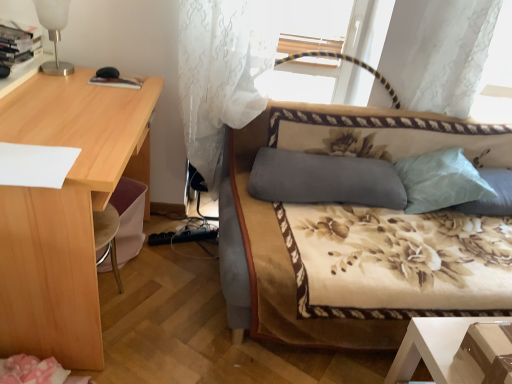
From the picture: In order to face light blue fabric pillow at right, which ranks as the first pillow in right-to-left order, should I rotate leftwards or rightwards?

Rotate right and turn 30.320 degrees.

The image size is (512, 384). Describe the element at coordinates (496, 192) in the screenshot. I see `light blue fabric pillow at right, which ranks as the first pillow in right-to-left order` at that location.

Describe the element at coordinates (65, 210) in the screenshot. I see `light wood desk at left` at that location.

Measure the distance between point (420,167) and camera.

Point (420,167) is 2.02 meters from camera.

Where is `white sheer curtain at center`? This screenshot has width=512, height=384. white sheer curtain at center is located at coordinates (222, 73).

Measure the distance between gray fabric pillow at center, which is the 1th pillow in left-to-right order, and camera.

gray fabric pillow at center, which is the 1th pillow in left-to-right order, is 1.82 meters from camera.

At what (x,y) coordinates should I click in order to perform the action: click on gray fabric pillow at center, which is the 1th pillow in left-to-right order. Please return your answer as a coordinate pair (x, y). The image size is (512, 384). Looking at the image, I should click on (324, 179).

The width and height of the screenshot is (512, 384). In order to click on white frosted glass table lamp at upper left in this screenshot , I will do `click(54, 32)`.

Is floral-patterned fabric couch at center located outside gray fabric pillow at center, which is the 1th pillow in left-to-right order?

That's correct, floral-patterned fabric couch at center is outside of gray fabric pillow at center, which is the 1th pillow in left-to-right order.

Are floral-patterned fabric couch at center and gray fabric pillow at center, which is the 1th pillow in left-to-right order, far apart?

floral-patterned fabric couch at center is actually quite close to gray fabric pillow at center, which is the 1th pillow in left-to-right order.

Is floral-patterned fabric couch at center looking in the opposite direction of gray fabric pillow at center, which is the 1th pillow in left-to-right order?

Correct, floral-patterned fabric couch at center is looking away from gray fabric pillow at center, which is the 1th pillow in left-to-right order.

Between floral-patterned fabric couch at center and gray fabric pillow at center, which is the 1th pillow in left-to-right order, which one has less height?

gray fabric pillow at center, which is the 1th pillow in left-to-right order, is shorter.

Which is closer, (61, 21) or (294, 305)?

Point (61, 21) is farther from the camera than point (294, 305).

Can you confirm if white frosted glass table lamp at upper left is smaller than floral-patterned fabric couch at center?

Yes.

How many degrees apart are the facing directions of white frosted glass table lamp at upper left and floral-patterned fabric couch at center?

91.2 degrees separate the facing orientations of white frosted glass table lamp at upper left and floral-patterned fabric couch at center.

From a real-world perspective, is gray fabric pillow at center, which is counted as the 3th pillow, starting from the right, located beneath white sheer curtain at center?

Correct, in the physical world, gray fabric pillow at center, which is counted as the 3th pillow, starting from the right, is lower than white sheer curtain at center.

From the image's perspective, is gray fabric pillow at center, which is the 1th pillow in left-to-right order, above white sheer curtain at center?

No, from the image's perspective, gray fabric pillow at center, which is the 1th pillow in left-to-right order, is not above white sheer curtain at center.

Does gray fabric pillow at center, which is counted as the 3th pillow, starting from the right, turn towards white sheer curtain at center?

No, gray fabric pillow at center, which is counted as the 3th pillow, starting from the right, is not turned towards white sheer curtain at center.

Choose the correct answer: Is gray fabric pillow at center, which is the 1th pillow in left-to-right order, inside white sheer curtain at center or outside it?

gray fabric pillow at center, which is the 1th pillow in left-to-right order, is not enclosed by white sheer curtain at center.

Looking at their sizes, would you say white frosted glass table lamp at upper left is wider or thinner than light blue textured pillow at upper right, the second pillow in the left-to-right sequence?

Clearly, white frosted glass table lamp at upper left has less width compared to light blue textured pillow at upper right, the second pillow in the left-to-right sequence.

Measure the distance from white frosted glass table lamp at upper left to light blue textured pillow at upper right, the second pillow in the left-to-right sequence.

white frosted glass table lamp at upper left is 1.70 meters from light blue textured pillow at upper right, the second pillow in the left-to-right sequence.

From the image's perspective, is white frosted glass table lamp at upper left above or below light blue textured pillow at upper right, which ranks as the second pillow in right-to-left order?

white frosted glass table lamp at upper left is situated higher than light blue textured pillow at upper right, which ranks as the second pillow in right-to-left order, in the image.

Considering the relative sizes of white frosted glass table lamp at upper left and light blue textured pillow at upper right, which ranks as the second pillow in right-to-left order, in the image provided, is white frosted glass table lamp at upper left taller than light blue textured pillow at upper right, which ranks as the second pillow in right-to-left order,?

Indeed, white frosted glass table lamp at upper left has a greater height compared to light blue textured pillow at upper right, which ranks as the second pillow in right-to-left order.

Who is shorter, floral-patterned fabric couch at center or light blue textured pillow at upper right, which ranks as the second pillow in right-to-left order?

Standing shorter between the two is light blue textured pillow at upper right, which ranks as the second pillow in right-to-left order.

Between point (254, 199) and point (465, 201), which one is positioned behind?

The point (465, 201) is more distant.

Would you say floral-patterned fabric couch at center is inside or outside light blue textured pillow at upper right, the second pillow in the left-to-right sequence?

floral-patterned fabric couch at center is located beyond the bounds of light blue textured pillow at upper right, the second pillow in the left-to-right sequence.

From a real-world perspective, is floral-patterned fabric couch at center positioned over light blue textured pillow at upper right, which ranks as the second pillow in right-to-left order, based on gravity?

No, from a real-world perspective, floral-patterned fabric couch at center is not on top of light blue textured pillow at upper right, which ranks as the second pillow in right-to-left order.

Considering the points (305, 170) and (247, 203), which point is behind, point (305, 170) or point (247, 203)?

The point (305, 170) is farther from the camera.

How different are the orientations of gray fabric pillow at center, which is the 1th pillow in left-to-right order, and floral-patterned fabric couch at center in degrees?

The angle between the facing direction of gray fabric pillow at center, which is the 1th pillow in left-to-right order, and the facing direction of floral-patterned fabric couch at center is 3.11 degrees.

Who is smaller, gray fabric pillow at center, which is the 1th pillow in left-to-right order, or floral-patterned fabric couch at center?

Smaller between the two is gray fabric pillow at center, which is the 1th pillow in left-to-right order.

In the scene shown: From the image's perspective, which is below, gray fabric pillow at center, which is counted as the 3th pillow, starting from the right, or floral-patterned fabric couch at center?

floral-patterned fabric couch at center, from the image's perspective.

Considering the sizes of objects light blue textured pillow at upper right, the second pillow in the left-to-right sequence, and gray fabric pillow at center, which is counted as the 3th pillow, starting from the right, in the image provided, who is taller, light blue textured pillow at upper right, the second pillow in the left-to-right sequence, or gray fabric pillow at center, which is counted as the 3th pillow, starting from the right,?

With more height is light blue textured pillow at upper right, the second pillow in the left-to-right sequence.

Is gray fabric pillow at center, which is counted as the 3th pillow, starting from the right, at the back of light blue textured pillow at upper right, the second pillow in the left-to-right sequence?

No.

Does light blue textured pillow at upper right, the second pillow in the left-to-right sequence, have a larger size compared to gray fabric pillow at center, which is counted as the 3th pillow, starting from the right?

Yes.

Image resolution: width=512 pixels, height=384 pixels. Find the location of `pillow on the left of floral-patterned fabric couch at center`. pillow on the left of floral-patterned fabric couch at center is located at coordinates (324, 179).

You are a GUI agent. You are given a task and a screenshot of the screen. Output one action in this format:
    pyautogui.click(x=<x>, y=<y>)
    Task: Click on the studio couch in front of the white frosted glass table lamp at upper left
    
    Given the screenshot: What is the action you would take?
    pyautogui.click(x=286, y=249)

When comparing their distances from light blue fabric pillow at right, which ranks as the first pillow in right-to-left order, does white sheer curtain at center or light blue textured pillow at upper right, which ranks as the second pillow in right-to-left order, seem closer?

light blue textured pillow at upper right, which ranks as the second pillow in right-to-left order, is positioned closer to the anchor light blue fabric pillow at right, which ranks as the first pillow in right-to-left order.

Which object lies further to the anchor point gray fabric pillow at center, which is the 1th pillow in left-to-right order, floral-patterned fabric couch at center or light blue textured pillow at upper right, the second pillow in the left-to-right sequence?

light blue textured pillow at upper right, the second pillow in the left-to-right sequence, is positioned further to the anchor gray fabric pillow at center, which is the 1th pillow in left-to-right order.

Looking at this image, looking at the image, which one is located closer to white frosted glass table lamp at upper left, light wood desk at left or light blue textured pillow at upper right, which ranks as the second pillow in right-to-left order?

light wood desk at left lies closer to white frosted glass table lamp at upper left than the other object.

Estimate the real-world distances between objects in this image. Which object is further from gray fabric pillow at center, which is counted as the 3th pillow, starting from the right, white frosted glass table lamp at upper left or light blue fabric pillow at right, which ranks as the first pillow in right-to-left order?

white frosted glass table lamp at upper left lies further to gray fabric pillow at center, which is counted as the 3th pillow, starting from the right, than the other object.

From the image, which object appears to be farther from white frosted glass table lamp at upper left, gray fabric pillow at center, which is the 1th pillow in left-to-right order, or light blue fabric pillow at right, which is the 3th pillow in left-to-right order?

light blue fabric pillow at right, which is the 3th pillow in left-to-right order.

Based on the photo, considering their positions, is light wood desk at left positioned closer to gray fabric pillow at center, which is the 1th pillow in left-to-right order, than light blue textured pillow at upper right, which ranks as the second pillow in right-to-left order?

The object closer to gray fabric pillow at center, which is the 1th pillow in left-to-right order, is light blue textured pillow at upper right, which ranks as the second pillow in right-to-left order.

Estimate the real-world distances between objects in this image. Which object is closer to gray fabric pillow at center, which is the 1th pillow in left-to-right order, light blue textured pillow at upper right, which ranks as the second pillow in right-to-left order, or white sheer curtain at center?

Among the two, light blue textured pillow at upper right, which ranks as the second pillow in right-to-left order, is located nearer to gray fabric pillow at center, which is the 1th pillow in left-to-right order.

When comparing their distances from floral-patterned fabric couch at center, does gray fabric pillow at center, which is counted as the 3th pillow, starting from the right, or light wood desk at left seem further?

light wood desk at left.

Locate an element on the screen. curtain between light wood desk at left and floral-patterned fabric couch at center from left to right is located at coordinates (222, 73).

Locate an element on the screen. The width and height of the screenshot is (512, 384). studio couch situated between gray fabric pillow at center, which is counted as the 3th pillow, starting from the right, and light blue fabric pillow at right, which ranks as the first pillow in right-to-left order, from left to right is located at coordinates (286, 249).

Find the location of a particular element. The image size is (512, 384). studio couch situated between white sheer curtain at center and light blue textured pillow at upper right, which ranks as the second pillow in right-to-left order, from left to right is located at coordinates (286, 249).

In order to click on desk between white frosted glass table lamp at upper left and gray fabric pillow at center, which is counted as the 3th pillow, starting from the right, from left to right in this screenshot , I will do `click(65, 210)`.